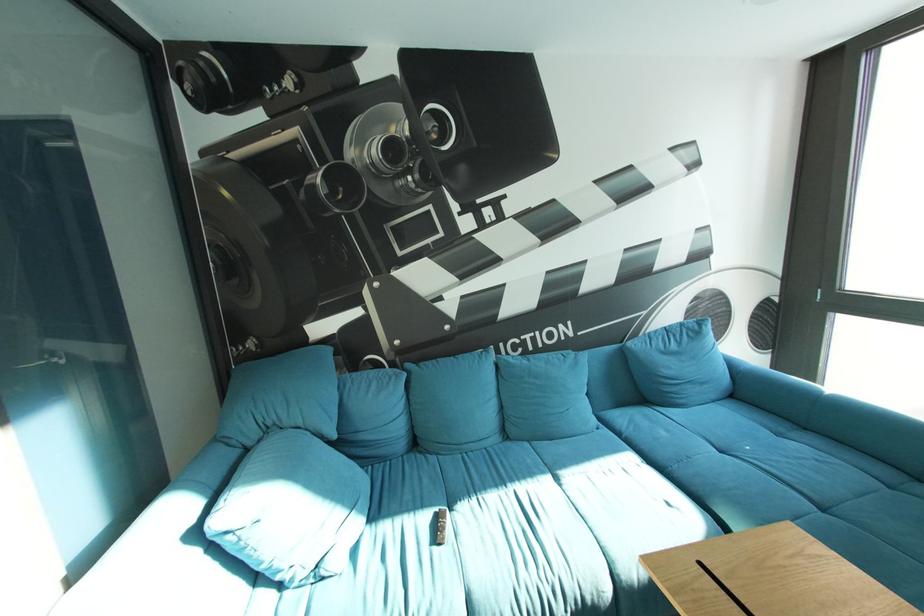
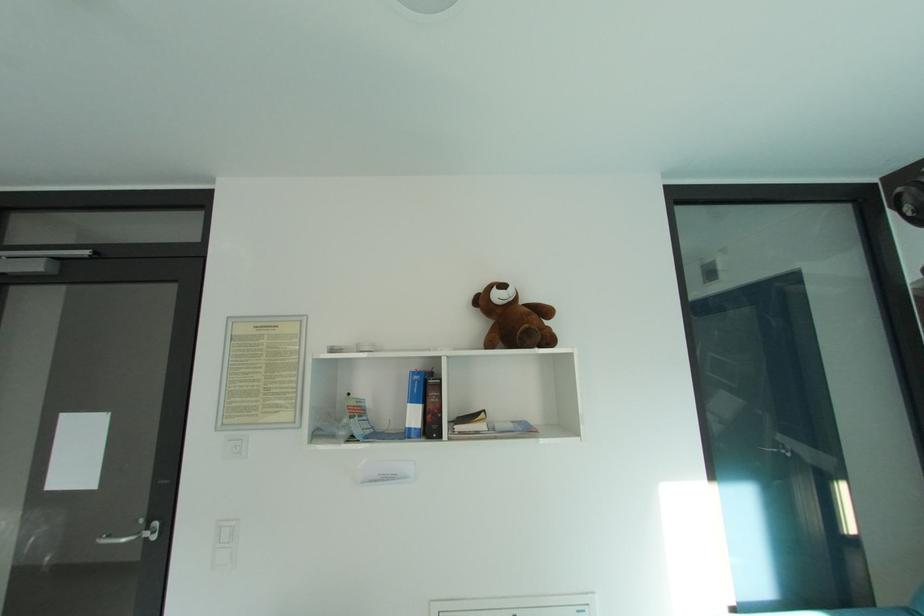
Question: The first image is from the beginning of the video and the second image is from the end. How did the camera likely rotate when shooting the video?

Choices:
 (A) Left
 (B) Right
 (C) Up
 (D) Down

Answer: (A)